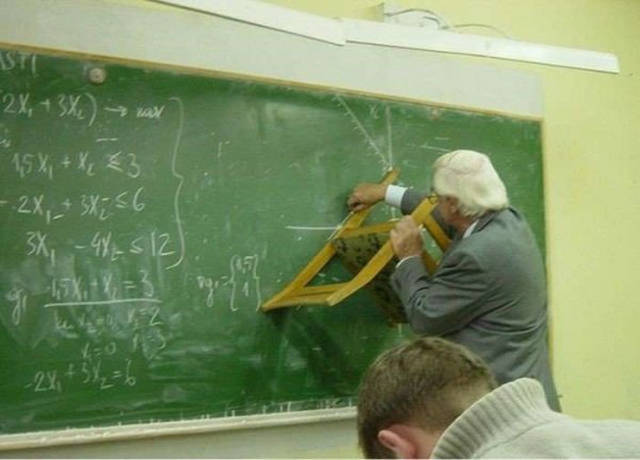
Where is `tray`? This screenshot has height=460, width=640. tray is located at coordinates 178,431.